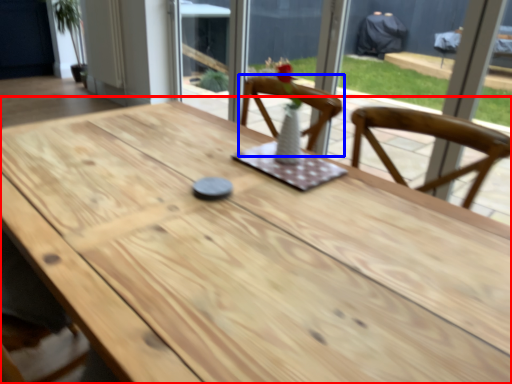
Question: Among these objects, which one is farthest to the camera, table (highlighted by a red box) or chair (highlighted by a blue box)?

Choices:
 (A) table
 (B) chair

Answer: (B)